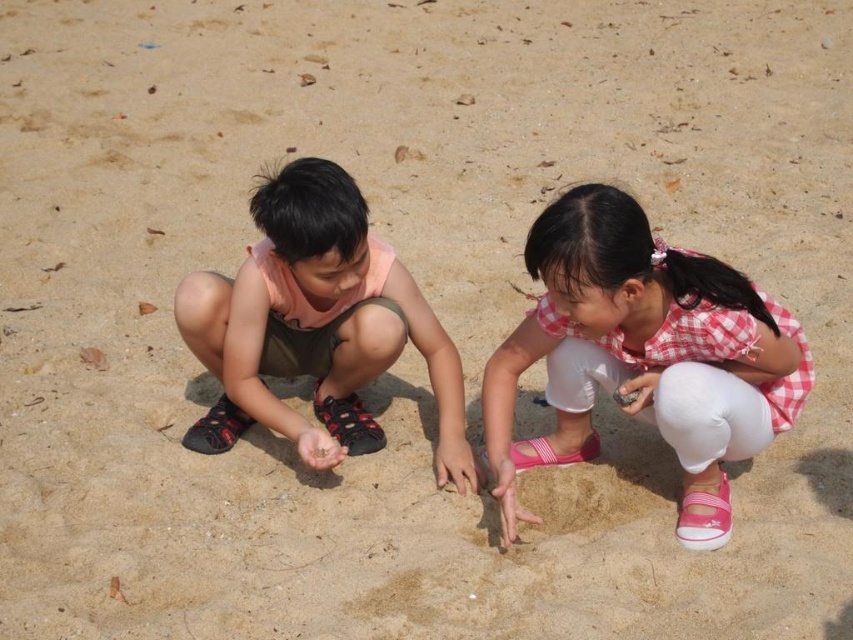
Locate an element on the screen. This screenshot has width=853, height=640. pink checkered shirt at center is located at coordinates (643, 355).